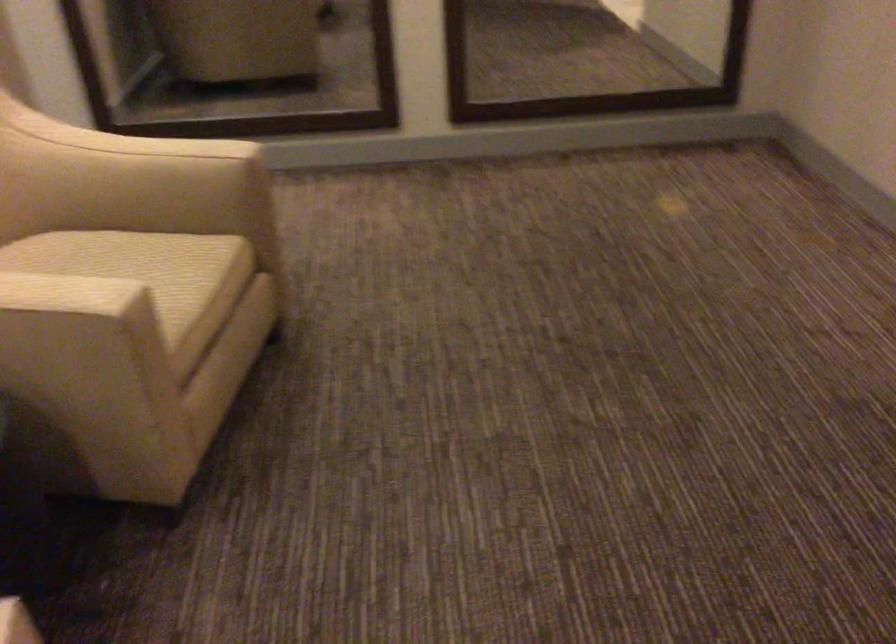
Question: The first image is from the beginning of the video and the second image is from the end. How did the camera likely rotate when shooting the video?

Choices:
 (A) Left
 (B) Right
 (C) Up
 (D) Down

Answer: (B)